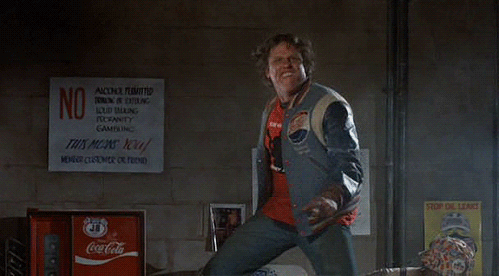
I want to click on wall, so coord(233,87).